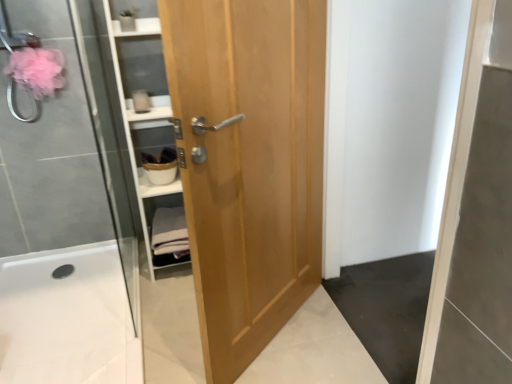
The height and width of the screenshot is (384, 512). Find the location of `free location above white cotton towels at center (from a real-world perspective)`. free location above white cotton towels at center (from a real-world perspective) is located at coordinates (168, 208).